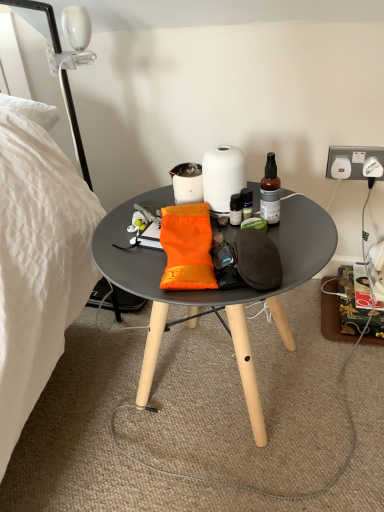
At what (x,y) coordinates should I click in order to perform the action: click on vacant area situated below matte black table at center (from a real-world perspective). Please return your answer as a coordinate pair (x, y). This screenshot has width=384, height=512. Looking at the image, I should click on (214, 384).